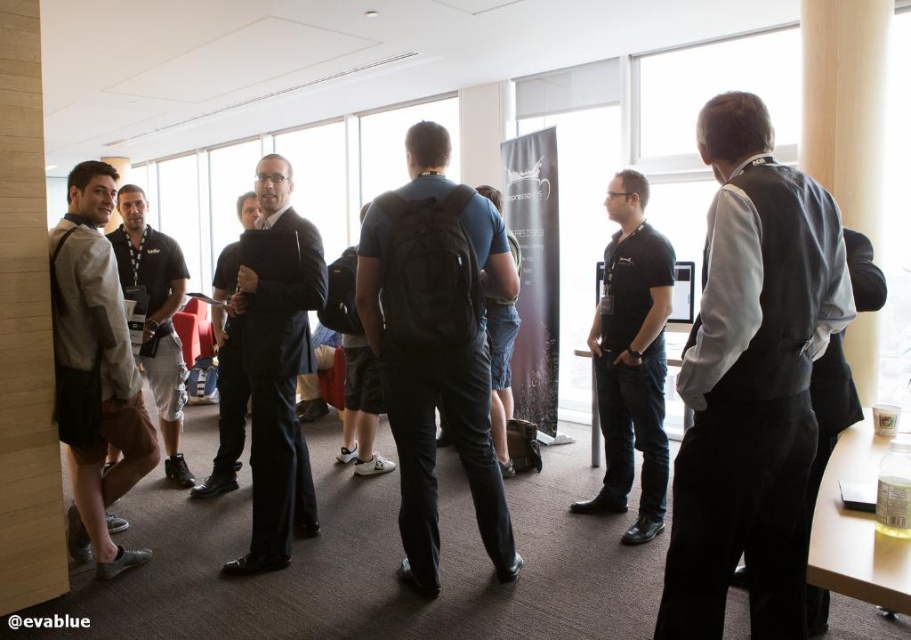
Who is more distant from viewer, [765,157] or [221,310]?

The point [221,310] is behind.

Is dark gray vest at right closer to camera compared to black matte suit at center?

That is True.

Which is in front, point (722, 417) or point (212, 326)?

Point (722, 417) is more forward.

This screenshot has height=640, width=911. In order to click on dark gray vest at right in this screenshot , I will do `click(751, 381)`.

Between matte black suit at center and wooden table at right, which one appears on the right side from the viewer's perspective?

wooden table at right is more to the right.

Who is taller, matte black suit at center or wooden table at right?

With more height is matte black suit at center.

Where is `matte black suit at center`? matte black suit at center is located at coordinates click(277, 376).

You are a GUI agent. You are given a task and a screenshot of the screen. Output one action in this format:
    pyautogui.click(x=<x>, y=<y>)
    Task: Click on the matte black suit at center
    The image size is (911, 640).
    Given the screenshot: What is the action you would take?
    pyautogui.click(x=277, y=376)

Does black matte suit at center appear on the left side of matte black backpack at center?

Yes, black matte suit at center is to the left of matte black backpack at center.

Does black matte suit at center have a smaller size compared to matte black backpack at center?

No.

Identify the location of black matte suit at center. The width and height of the screenshot is (911, 640). (226, 380).